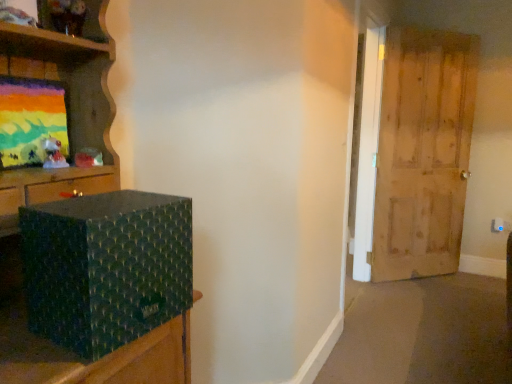
Question: Does wooden door at right come in front of green textured box at left?

Choices:
 (A) yes
 (B) no

Answer: (B)

Question: Is wooden door at right touching green textured box at left?

Choices:
 (A) yes
 (B) no

Answer: (B)

Question: From a real-world perspective, is wooden door at right positioned under green textured box at left based on gravity?

Choices:
 (A) no
 (B) yes

Answer: (A)

Question: Can you confirm if wooden door at right is positioned to the right of green textured box at left?

Choices:
 (A) no
 (B) yes

Answer: (B)

Question: Considering the relative sizes of wooden door at right and green textured box at left in the image provided, is wooden door at right wider than green textured box at left?

Choices:
 (A) yes
 (B) no

Answer: (B)

Question: Does point (31, 120) appear closer or farther from the camera than point (361, 198)?

Choices:
 (A) closer
 (B) farther

Answer: (A)

Question: From the image's perspective, is matte painted canvas at upper left positioned above or below wooden door at right?

Choices:
 (A) above
 (B) below

Answer: (B)

Question: From a real-world perspective, is matte painted canvas at upper left positioned above or below wooden door at right?

Choices:
 (A) above
 (B) below

Answer: (A)

Question: Is matte painted canvas at upper left spatially inside wooden door at right, or outside of it?

Choices:
 (A) inside
 (B) outside

Answer: (B)

Question: Visually, is matte painted canvas at upper left positioned to the left or to the right of green textured box at left?

Choices:
 (A) right
 (B) left

Answer: (B)

Question: From the image's perspective, is matte painted canvas at upper left positioned above or below green textured box at left?

Choices:
 (A) above
 (B) below

Answer: (A)

Question: Is matte painted canvas at upper left inside the boundaries of green textured box at left, or outside?

Choices:
 (A) outside
 (B) inside

Answer: (A)

Question: From a real-world perspective, is matte painted canvas at upper left positioned above or below green textured box at left?

Choices:
 (A) above
 (B) below

Answer: (A)

Question: Considering the positions of green textured box at left and wooden door at right in the image, is green textured box at left taller or shorter than wooden door at right?

Choices:
 (A) short
 (B) tall

Answer: (A)

Question: Is point (66, 294) positioned closer to the camera than point (467, 132)?

Choices:
 (A) farther
 (B) closer

Answer: (B)